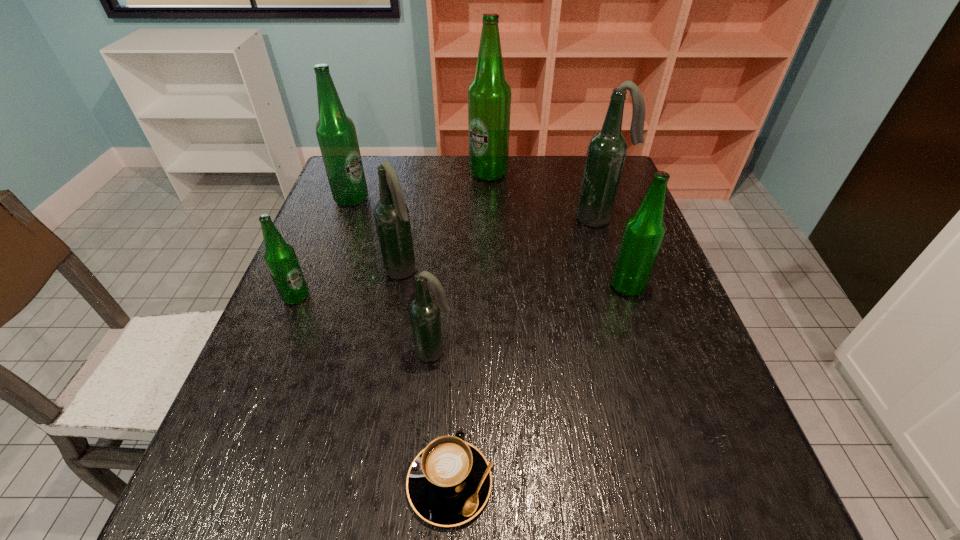
This screenshot has height=540, width=960. I want to click on free space located 0.150m on the label of the second smallest green beer bottle, so click(545, 286).

Where is `vacant space located 0.090m on the label of the smallest green beer bottle`? This screenshot has height=540, width=960. vacant space located 0.090m on the label of the smallest green beer bottle is located at coordinates (349, 296).

Identify the location of vacant space located 0.100m on the front of the smallest dark beer bottle. (430, 409).

Identify the location of free location located 0.250m on the back of the cappuccino. The width and height of the screenshot is (960, 540). (458, 329).

At what (x,y) coordinates should I click in order to perform the action: click on object present at the near edge. Please return your answer as a coordinate pair (x, y). Looking at the image, I should click on (449, 482).

Where is `object at the far left corner`? Image resolution: width=960 pixels, height=540 pixels. object at the far left corner is located at coordinates (336, 133).

What are the coordinates of `vacant space at the far edge of the desktop` in the screenshot? It's located at (539, 179).

Find the location of a particular element. vacant space at the near edge of the desktop is located at coordinates (373, 489).

What are the coordinates of `vacant space at the left edge of the desktop` in the screenshot? It's located at (280, 466).

Locate an element on the screen. Image resolution: width=960 pixels, height=540 pixels. vacant region at the right edge of the desktop is located at coordinates (653, 318).